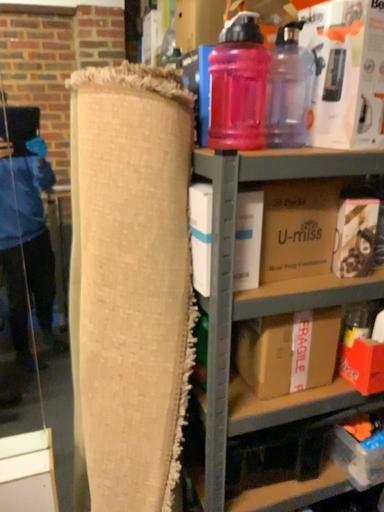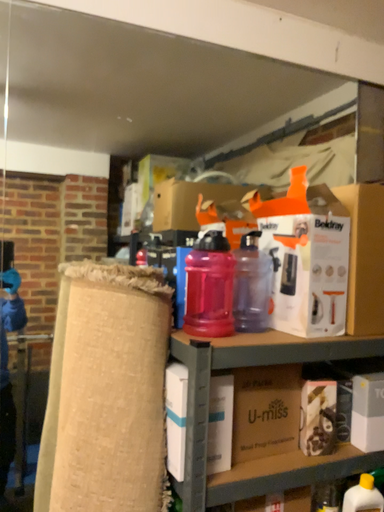
Question: How did the camera likely rotate when shooting the video?

Choices:
 (A) rotated upward
 (B) rotated downward

Answer: (A)